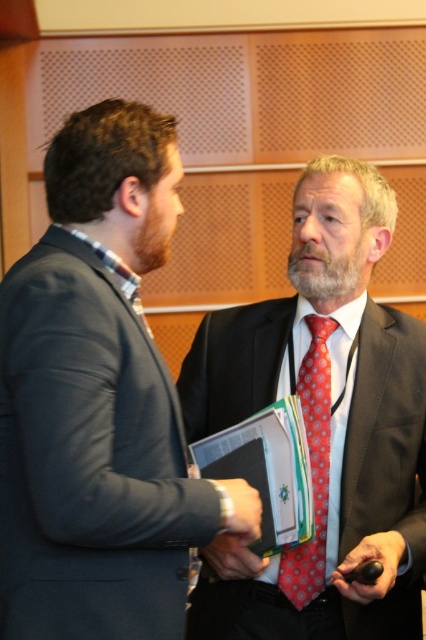
Can you confirm if matte black suit at center is positioned to the right of red dotted tie at center?

Incorrect, matte black suit at center is not on the right side of red dotted tie at center.

Is matte black suit at center positioned behind red dotted tie at center?

That is False.

Is point (351, 419) more distant than point (327, 328)?

No, it is in front of (327, 328).

You are a GUI agent. You are given a task and a screenshot of the screen. Output one action in this format:
    pyautogui.click(x=<x>, y=<y>)
    Task: Click on the matte black suit at center
    The image size is (426, 640).
    Given the screenshot: What is the action you would take?
    pyautogui.click(x=322, y=426)

Does matte black suit at left have a greater height compared to matte black suit at center?

No, matte black suit at left is not taller than matte black suit at center.

Does matte black suit at left have a larger size compared to matte black suit at center?

No, matte black suit at left is not bigger than matte black suit at center.

Between point (198, 492) and point (310, 627), which one is positioned behind?

Point (310, 627)

Locate an element on the screen. The width and height of the screenshot is (426, 640). matte black suit at left is located at coordinates (98, 401).

Is matte black suit at left bigger than red dotted tie at center?

Yes, matte black suit at left is bigger than red dotted tie at center.

Can you confirm if matte black suit at left is positioned to the right of red dotted tie at center?

No, matte black suit at left is not to the right of red dotted tie at center.

Identify the location of matte black suit at left. This screenshot has width=426, height=640. (98, 401).

I want to click on matte black suit at left, so click(98, 401).